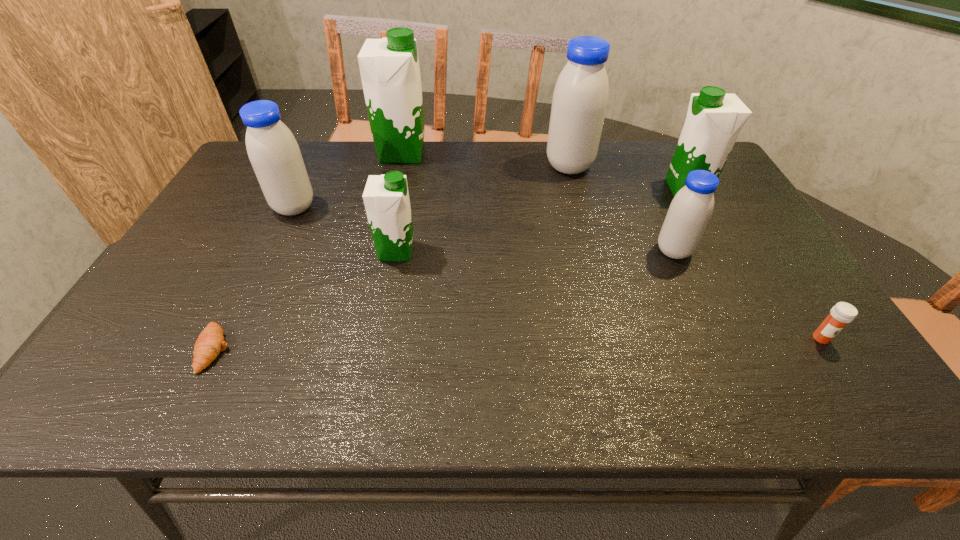
You are a GUI agent. You are given a task and a screenshot of the screen. Output one action in this format:
    pyautogui.click(x=<x>, y=<y>)
    Task: Click on the rightmost object
    
    Given the screenshot: What is the action you would take?
    pyautogui.click(x=841, y=314)

What are the coordinates of `medicine` in the screenshot? It's located at (841, 314).

Find the location of a particular element. The image size is (960, 540). crescent roll is located at coordinates (210, 343).

What are the coordinates of `vacant space situated 0.200m on the front-facing side of the biggest green soya milk` in the screenshot? It's located at (487, 153).

Where is `free space located on the right of the second blue soya milk from left to right`? free space located on the right of the second blue soya milk from left to right is located at coordinates (618, 166).

In order to click on blank area located 0.140m on the front-facing side of the second farthest green soya milk in this screenshot , I will do `click(619, 189)`.

In order to click on free space located on the front-facing side of the second farthest green soya milk in this screenshot , I will do `click(576, 189)`.

This screenshot has width=960, height=540. Find the location of `vacant space situated 0.170m on the front-facing side of the second farthest green soya milk`. vacant space situated 0.170m on the front-facing side of the second farthest green soya milk is located at coordinates (609, 189).

The image size is (960, 540). Find the location of `vacant region located 0.080m on the right of the leftmost soya milk`. vacant region located 0.080m on the right of the leftmost soya milk is located at coordinates (344, 207).

In order to click on vacant area situated on the front-facing side of the nearest green soya milk in this screenshot , I will do `click(501, 251)`.